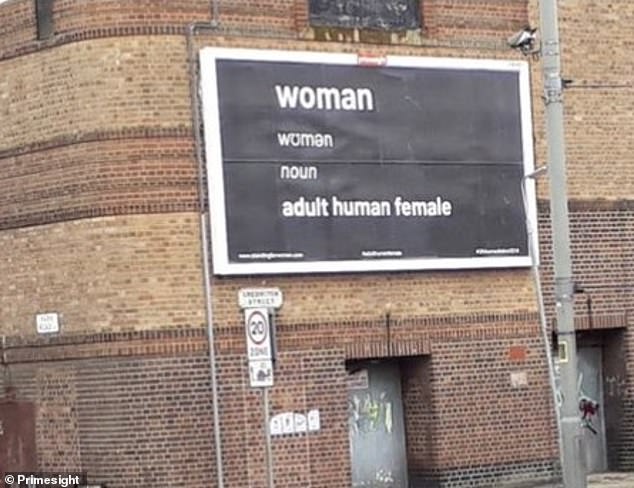
Find the location of a particular element. The height and width of the screenshot is (488, 634). small white poster is located at coordinates (272, 427), (288, 427), (302, 424), (317, 419).